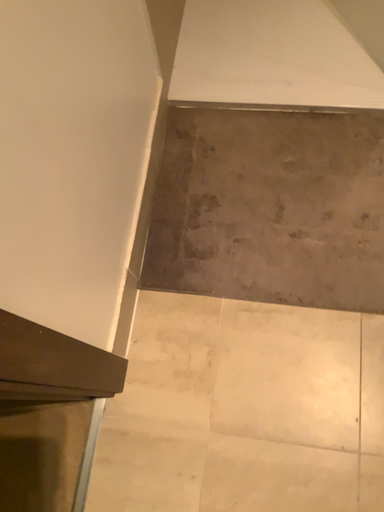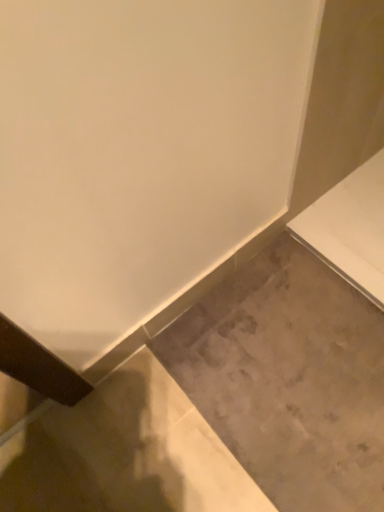
Question: How did the camera likely rotate when shooting the video?

Choices:
 (A) rotated downward
 (B) rotated upward

Answer: (B)